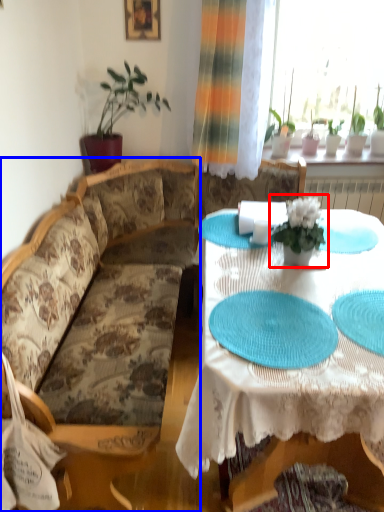
Question: Which of the following is the farthest to the observer, houseplant (highlighted by a red box) or studio couch (highlighted by a blue box)?

Choices:
 (A) houseplant
 (B) studio couch

Answer: (A)